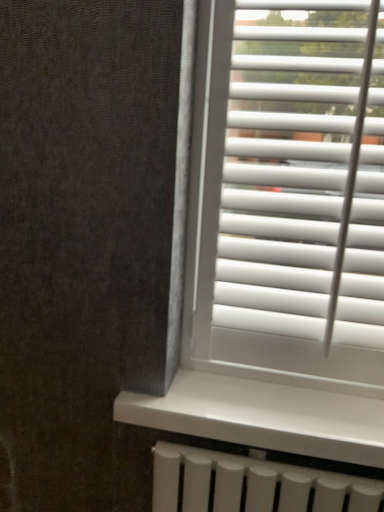
The height and width of the screenshot is (512, 384). In order to click on free spot above white smooth window sill at center (from a real-world perspective) in this screenshot , I will do `click(261, 400)`.